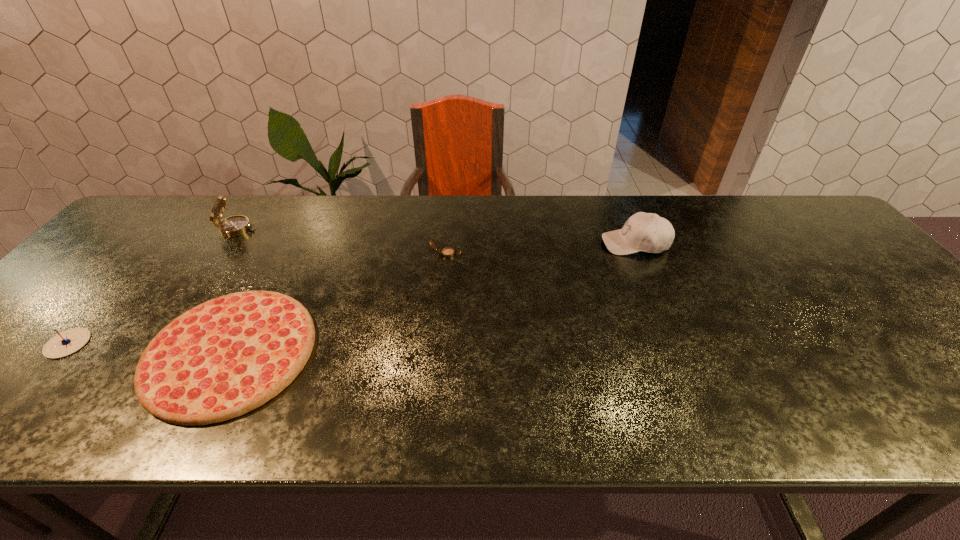
Where is `the tallest compass`? The width and height of the screenshot is (960, 540). the tallest compass is located at coordinates (237, 225).

You are a GUI agent. You are given a task and a screenshot of the screen. Output one action in this format:
    pyautogui.click(x=<x>, y=<y>)
    Task: Click on the second compass from left to right
    
    Given the screenshot: What is the action you would take?
    pyautogui.click(x=237, y=225)

The width and height of the screenshot is (960, 540). In order to click on baseball cap in this screenshot , I will do `click(648, 232)`.

What are the coordinates of `the nearest compass` in the screenshot? It's located at (67, 342).

Locate an element on the screen. Image resolution: width=960 pixels, height=540 pixels. the leftmost compass is located at coordinates (67, 342).

Identify the location of the rightmost compass. [447, 252].

Find the location of a particular element. The width and height of the screenshot is (960, 540). the second farthest compass is located at coordinates (447, 252).

The width and height of the screenshot is (960, 540). I want to click on the shortest object, so 230,355.

Find the location of a particular element. vacant space located 0.250m with the dial facing the tallest compass is located at coordinates (340, 229).

I want to click on free space located on the front-facing side of the baseball cap, so click(x=508, y=244).